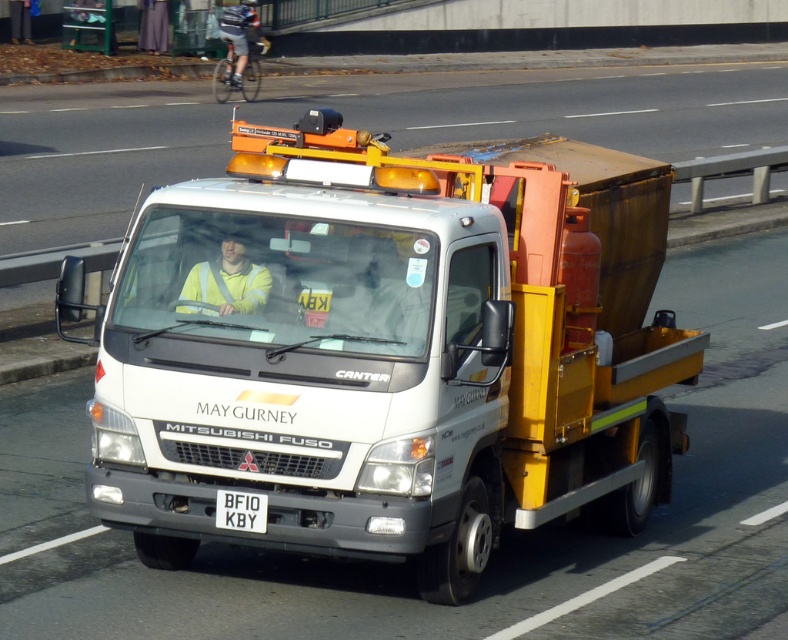
Can you confirm if yellow reflective vest at center is wider than white plastic license plate at center?

Indeed, yellow reflective vest at center has a greater width compared to white plastic license plate at center.

Who is lower down, yellow reflective vest at center or white plastic license plate at center?

Positioned lower is white plastic license plate at center.

Find the location of a particular element. This screenshot has height=640, width=788. yellow reflective vest at center is located at coordinates (381, 285).

This screenshot has height=640, width=788. In order to click on yellow reflective vest at center in this screenshot , I will do `click(381, 285)`.

Which is more to the right, yellow reflective vest at center or yellow high-visibility jacket at center?

From the viewer's perspective, yellow reflective vest at center appears more on the right side.

Measure the distance from yellow reflective vest at center to yellow high-visibility jacket at center.

22.85 inches

Where is `yellow reflective vest at center`? The height and width of the screenshot is (640, 788). yellow reflective vest at center is located at coordinates (381, 285).

I want to click on yellow reflective vest at center, so 381,285.

Image resolution: width=788 pixels, height=640 pixels. What do you see at coordinates (385, 362) in the screenshot?
I see `white matte truck at center` at bounding box center [385, 362].

Consider the image. Is white matte truck at center positioned at the back of yellow high-visibility jacket at center?

No, white matte truck at center is in front of yellow high-visibility jacket at center.

This screenshot has width=788, height=640. What do you see at coordinates (385, 362) in the screenshot?
I see `white matte truck at center` at bounding box center [385, 362].

This screenshot has width=788, height=640. Find the location of `white matte truck at center`. white matte truck at center is located at coordinates (385, 362).